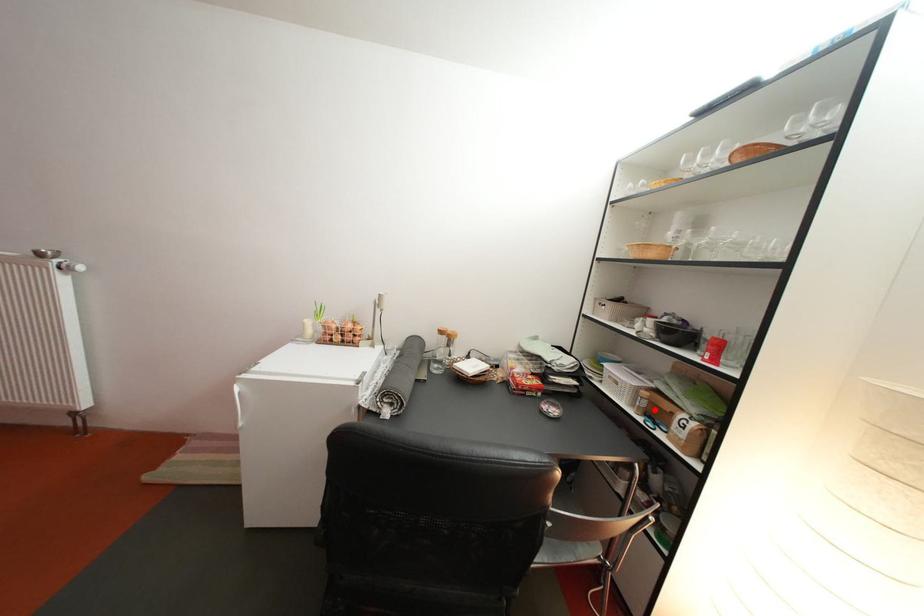
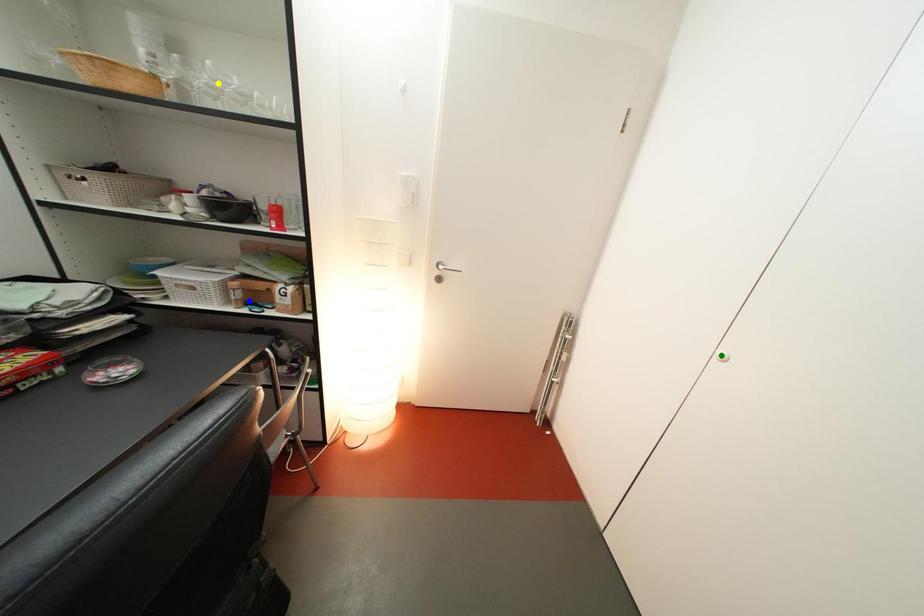
Question: I am providing you with two images of the same scene from different viewpoints. A red point is marked on the first image. You are given multiple points on the second image. Which point in image 2 represents the same 3d spot as the red point in image 1?

Choices:
 (A) green point
 (B) blue point
 (C) yellow point

Answer: (B)